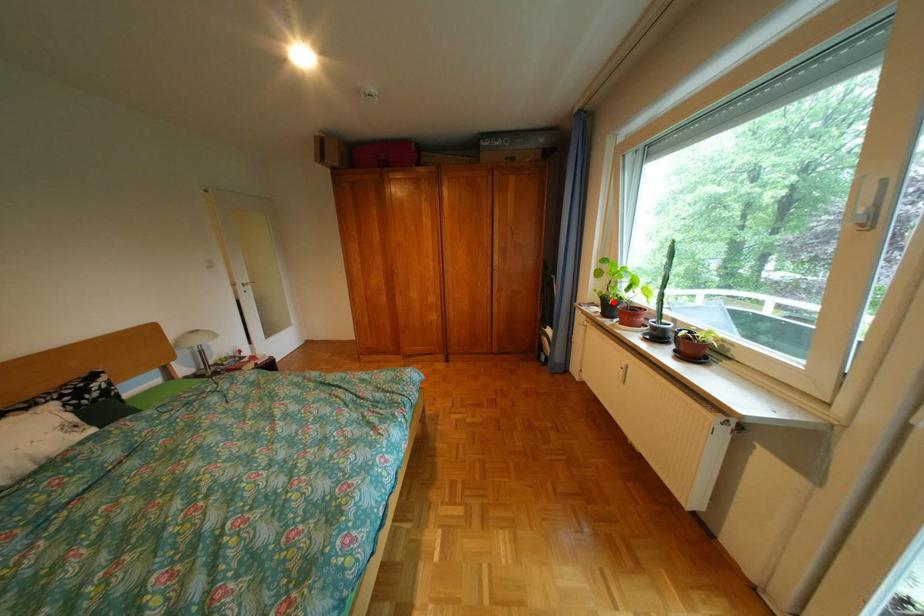
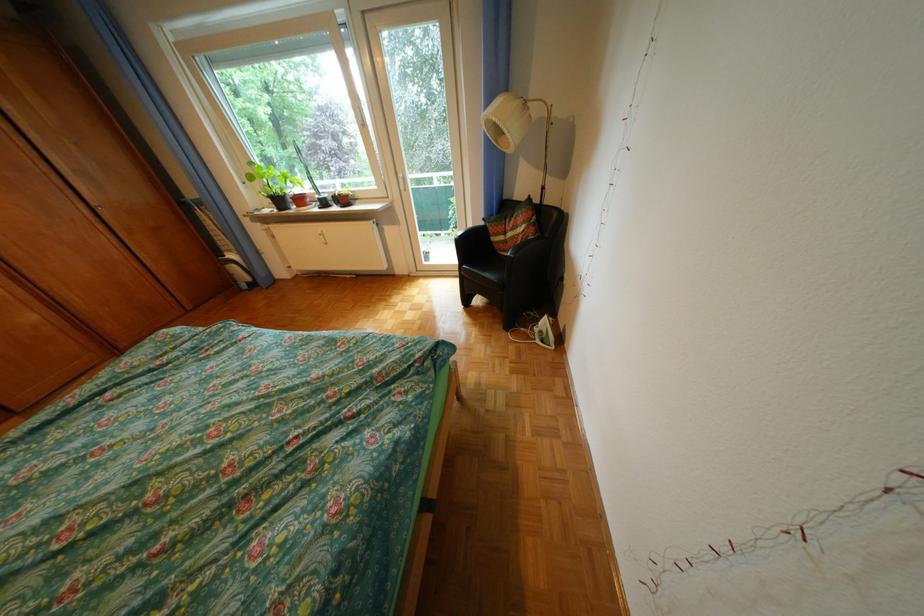
Where in the second image is the point corresponding to the highlighted location from the first image?

(284, 201)